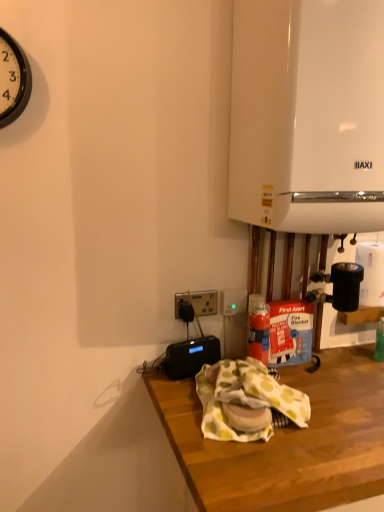
Image resolution: width=384 pixels, height=512 pixels. Find the location of `vacant space situated above wooden desk at lower center (from a real-world perspective)`. vacant space situated above wooden desk at lower center (from a real-world perspective) is located at coordinates (324, 402).